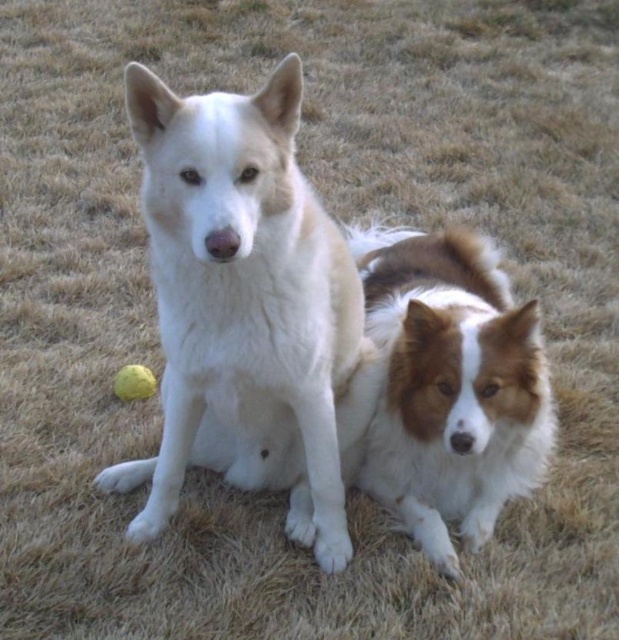
Question: Is white fur dog at center to the left of brown/white fur dog at lower right from the viewer's perspective?

Choices:
 (A) yes
 (B) no

Answer: (A)

Question: Is white fur dog at center to the left of brown/white fur dog at lower right from the viewer's perspective?

Choices:
 (A) no
 (B) yes

Answer: (B)

Question: Is white fur dog at center positioned in front of brown/white fur dog at lower right?

Choices:
 (A) yes
 (B) no

Answer: (A)

Question: Which point is closer to the camera?

Choices:
 (A) brown/white fur dog at lower right
 (B) white fur dog at center

Answer: (B)